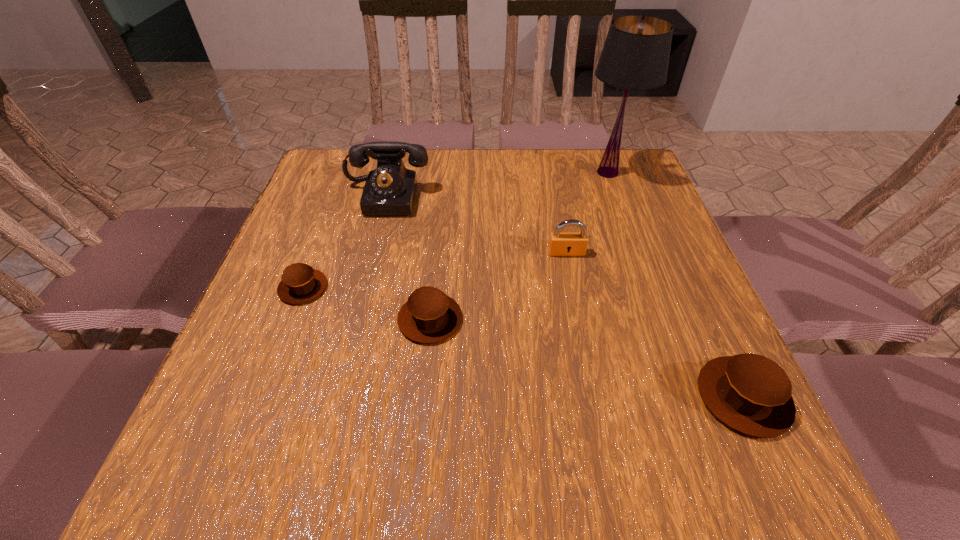
If the aim is uniform spacing by inserting an additional muffin among them, please point to a vacant space for this new muffin. Please provide its 2D coordinates. Your answer should be formatted as a tuple, i.e. [(x, y)], where the tuple contains the x and y coordinates of a point satisfying the conditions above.

[(575, 355)]